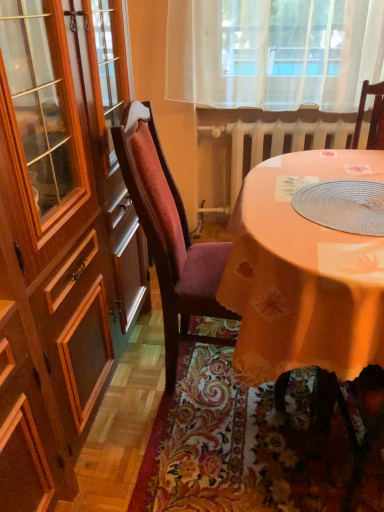
Where is `white painted metal radiator at center`? The image size is (384, 512). white painted metal radiator at center is located at coordinates (277, 140).

What do you see at coordinates (263, 442) in the screenshot? I see `silky orange tablecloth at lower center` at bounding box center [263, 442].

The width and height of the screenshot is (384, 512). What are the coordinates of `white painted metal radiator at center` in the screenshot? It's located at 277,140.

Is orange fabric table at center placed right next to velvet burgundy chair at center?

No, orange fabric table at center is not in contact with velvet burgundy chair at center.

Considering the relative sizes of orange fabric table at center and velvet burgundy chair at center in the image provided, is orange fabric table at center shorter than velvet burgundy chair at center?

Answer: Yes.

Looking at the image, does orange fabric table at center seem bigger or smaller compared to velvet burgundy chair at center?

orange fabric table at center is bigger than velvet burgundy chair at center.

Which is closer to the camera, (245, 230) or (172, 297)?

The point (245, 230) is in front.

Which point is more forward, (322, 257) or (362, 139)?

Point (322, 257)

Is the position of orange fabric table at center more distant than that of white painted metal radiator at center?

No, it is not.

From the image's perspective, which object appears higher, orange fabric table at center or white painted metal radiator at center?

white painted metal radiator at center appears higher in the image.

At what (x,y) coordinates should I click in order to perform the action: click on radiator behind the orange fabric table at center. Please return your answer as a coordinate pair (x, y). Looking at the image, I should click on (277, 140).

Is white painted metal radiator at center aimed at silky orange tablecloth at lower center?

Yes, white painted metal radiator at center faces towards silky orange tablecloth at lower center.

Identify the location of radiator on the right of silky orange tablecloth at lower center. The image size is (384, 512). (277, 140).

Would you say white painted metal radiator at center is to the left or to the right of silky orange tablecloth at lower center in the picture?

Based on their positions, white painted metal radiator at center is located to the right of silky orange tablecloth at lower center.

Does clear plastic placemat at center have a smaller size compared to white painted metal radiator at center?

Yes.

From a real-world perspective, is clear plastic placemat at center physically located above or below white painted metal radiator at center?

Clearly, from a real-world perspective, clear plastic placemat at center is above white painted metal radiator at center.

Is clear plastic placemat at center positioned in front of white painted metal radiator at center?

Yes, it is in front of white painted metal radiator at center.

In terms of width, does clear plastic placemat at center look wider or thinner when compared to white painted metal radiator at center?

Considering their sizes, clear plastic placemat at center looks broader than white painted metal radiator at center.

Does silky orange tablecloth at lower center have a lesser height compared to white painted metal radiator at center?

Yes.

Looking at their sizes, would you say silky orange tablecloth at lower center is wider or thinner than white painted metal radiator at center?

silky orange tablecloth at lower center is wider than white painted metal radiator at center.

Considering the positions of point (292, 438) and point (280, 146), is point (292, 438) closer or farther from the camera than point (280, 146)?

Point (292, 438) is closer to the camera than point (280, 146).

Does silky orange tablecloth at lower center contain white painted metal radiator at center?

Actually, white painted metal radiator at center is outside silky orange tablecloth at lower center.

Does orange fabric table at center have a lesser width compared to clear plastic placemat at center?

In fact, orange fabric table at center might be wider than clear plastic placemat at center.

Is orange fabric table at center oriented towards clear plastic placemat at center?

No, orange fabric table at center is not facing towards clear plastic placemat at center.

Locate an element on the screen. This screenshot has height=512, width=384. tableware located above the orange fabric table at center (from a real-world perspective) is located at coordinates (343, 205).

Can we say orange fabric table at center lies outside clear plastic placemat at center?

Yes, orange fabric table at center is not within clear plastic placemat at center.

Considering the sizes of objects clear plastic placemat at center and orange fabric table at center in the image provided, who is smaller, clear plastic placemat at center or orange fabric table at center?

Smaller between the two is clear plastic placemat at center.

Is clear plastic placemat at center placed right next to orange fabric table at center?

No, clear plastic placemat at center is not next to orange fabric table at center.

Considering the sizes of objects clear plastic placemat at center and orange fabric table at center in the image provided, who is wider, clear plastic placemat at center or orange fabric table at center?

With larger width is orange fabric table at center.

Where is `chair above the orange fabric table at center (from a real-world perspective)`? The height and width of the screenshot is (512, 384). chair above the orange fabric table at center (from a real-world perspective) is located at coordinates (169, 234).

The width and height of the screenshot is (384, 512). I want to click on desk below the white painted metal radiator at center (from the image's perspective), so click(x=303, y=274).

From the image, which object appears to be farther from velvet burgundy chair at center, clear plastic placemat at center or white painted metal radiator at center?

Based on the image, white painted metal radiator at center appears to be further to velvet burgundy chair at center.

From the image, which object appears to be nearer to clear plastic placemat at center, white painted metal radiator at center or velvet burgundy chair at center?

Based on the image, velvet burgundy chair at center appears to be nearer to clear plastic placemat at center.

Which object lies further to the anchor point velvet burgundy chair at center, clear plastic placemat at center or silky orange tablecloth at lower center?

clear plastic placemat at center.

Considering their positions, is silky orange tablecloth at lower center positioned further to clear plastic placemat at center than velvet burgundy chair at center?

Based on the image, silky orange tablecloth at lower center appears to be further to clear plastic placemat at center.

Based on their spatial positions, is velvet burgundy chair at center or silky orange tablecloth at lower center closer to clear plastic placemat at center?

The object closer to clear plastic placemat at center is velvet burgundy chair at center.

Which object lies further to the anchor point orange fabric table at center, silky orange tablecloth at lower center or white painted metal radiator at center?

white painted metal radiator at center is further to orange fabric table at center.

Which object lies further to the anchor point silky orange tablecloth at lower center, velvet burgundy chair at center or orange fabric table at center?

orange fabric table at center.

From the image, which object appears to be farther from white painted metal radiator at center, velvet burgundy chair at center or silky orange tablecloth at lower center?

Among the two, silky orange tablecloth at lower center is located further to white painted metal radiator at center.

You are a GUI agent. You are given a task and a screenshot of the screen. Output one action in this format:
    pyautogui.click(x=<x>, y=<y>)
    Task: Click on the mat between clear plastic placemat at center and white painted metal radiator at center along the z-axis
    The width and height of the screenshot is (384, 512).
    Given the screenshot: What is the action you would take?
    pyautogui.click(x=263, y=442)

Where is `desk between velvet burgundy chair at center and clear plastic placemat at center`? This screenshot has height=512, width=384. desk between velvet burgundy chair at center and clear plastic placemat at center is located at coordinates (303, 274).

Locate an element on the screen. The image size is (384, 512). chair between orange fabric table at center and white painted metal radiator at center along the z-axis is located at coordinates (169, 234).

The image size is (384, 512). Find the location of `chair between clear plastic placemat at center and white painted metal radiator at center from front to back`. chair between clear plastic placemat at center and white painted metal radiator at center from front to back is located at coordinates (169, 234).